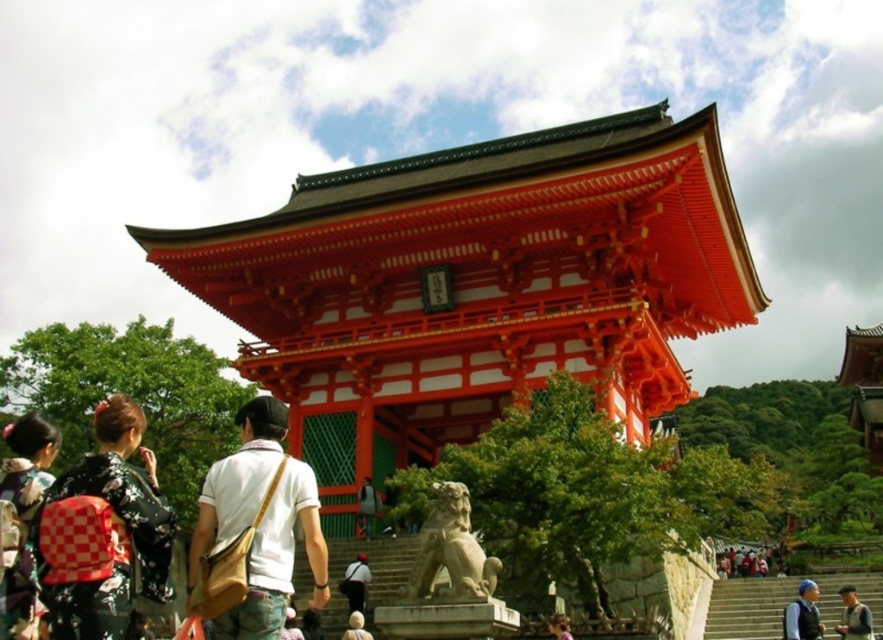
Can you confirm if brown canvas bag at center is bigger than white cotton shirt at center?

Indeed, brown canvas bag at center has a larger size compared to white cotton shirt at center.

Between brown canvas bag at center and white cotton shirt at center, which one has more height?

With more height is brown canvas bag at center.

Is point (275, 637) behind point (367, 518)?

No, (275, 637) is closer to viewer.

Identify the location of brown canvas bag at center. Image resolution: width=883 pixels, height=640 pixels. (254, 531).

Is brown canvas bag at center further to camera compared to light brown leather backpack at center?

No.

Between brown canvas bag at center and light brown leather backpack at center, which one is positioned lower?

light brown leather backpack at center is below.

Where is `brown canvas bag at center`? brown canvas bag at center is located at coordinates (254, 531).

Which is behind, point (232, 624) or point (23, 513)?

Positioned behind is point (23, 513).

Does brown canvas bag at center appear over kimono at left?

Actually, brown canvas bag at center is below kimono at left.

The height and width of the screenshot is (640, 883). Describe the element at coordinates (254, 531) in the screenshot. I see `brown canvas bag at center` at that location.

Where is `brown canvas bag at center`? This screenshot has height=640, width=883. brown canvas bag at center is located at coordinates (254, 531).